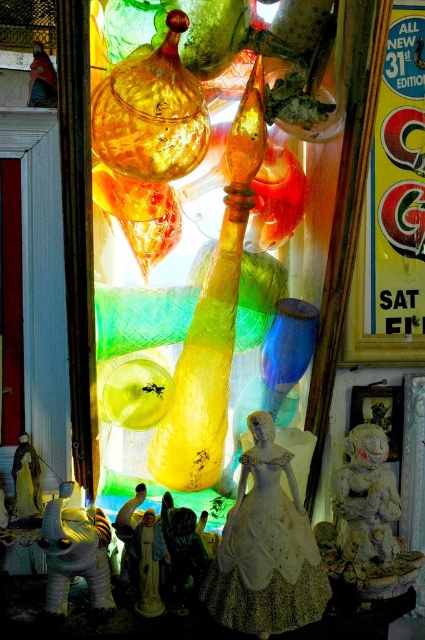
Question: Based on their relative distances, which object is nearer to the white matte elephant at lower left?

Choices:
 (A) white lace dress at center
 (B) white stone figurine at lower right

Answer: (A)

Question: Does white lace dress at center appear over white stone figurine at lower right?

Choices:
 (A) yes
 (B) no

Answer: (B)

Question: Which point is closer to the camera taking this photo?

Choices:
 (A) (297, 621)
 (B) (152, 538)
 (C) (385, 454)
 (D) (96, 552)

Answer: (A)

Question: Can you confirm if white lace dress at center is positioned to the left of white stone figurine at lower right?

Choices:
 (A) no
 (B) yes

Answer: (B)

Question: Considering the real-world distances, which object is closest to the white stone figurine at lower right?

Choices:
 (A) white lace dress at center
 (B) white matte elephant at lower left

Answer: (A)

Question: Can you confirm if white lace dress at center is positioned above white stone figurine at lower right?

Choices:
 (A) no
 (B) yes

Answer: (A)